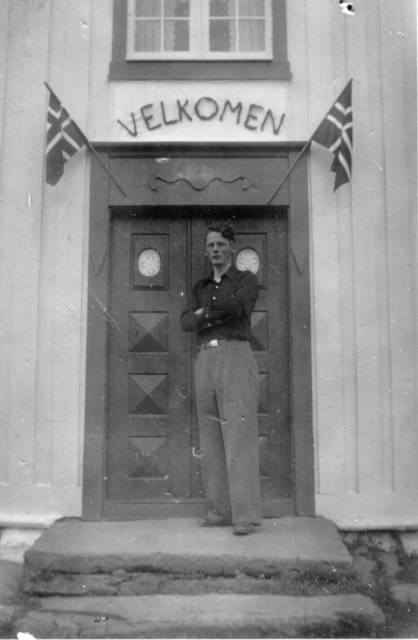
Question: Is wooden door at center above white fabric flag at upper left?

Choices:
 (A) yes
 (B) no

Answer: (B)

Question: Can you confirm if concrete steps at lower center is wider than white fabric flag at upper left?

Choices:
 (A) no
 (B) yes

Answer: (B)

Question: Which object is farther from the camera taking this photo?

Choices:
 (A) smooth gray pants at center
 (B) concrete steps at lower center
 (C) white fabric flag at upper right
 (D) white fabric flag at upper left

Answer: (C)

Question: Does concrete steps at lower center appear under smooth gray pants at center?

Choices:
 (A) no
 (B) yes

Answer: (B)

Question: Among these points, which one is nearest to the camera?

Choices:
 (A) (65, 115)
 (B) (349, 173)
 (C) (325, 620)

Answer: (C)

Question: Which object is farther from the camera taking this photo?

Choices:
 (A) white fabric flag at upper right
 (B) smooth gray pants at center

Answer: (A)